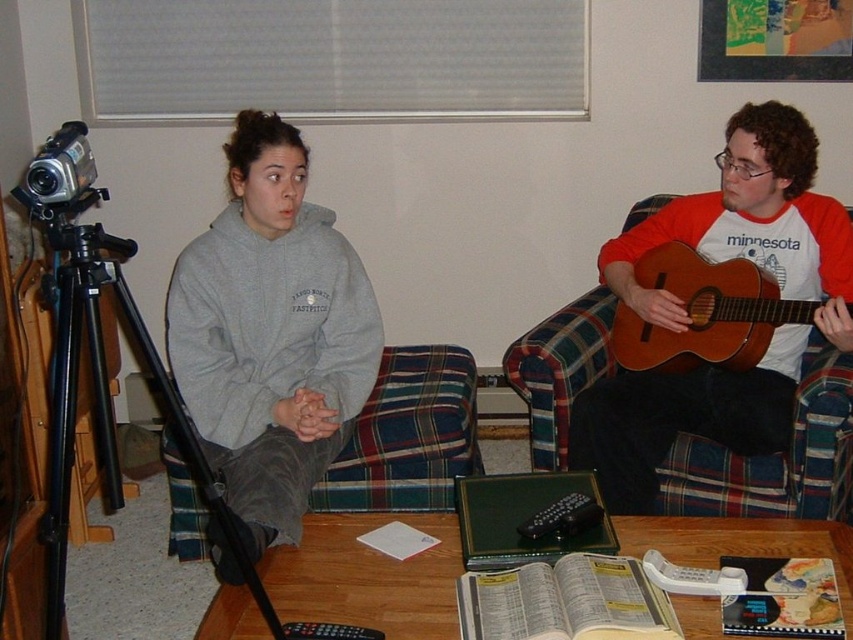
Is brown wooden guitar at right above black plastic remote at lower center?

Correct, brown wooden guitar at right is located above black plastic remote at lower center.

Does point (698, 268) come farther from viewer compared to point (288, 636)?

Yes, it is.

Locate an element on the screen. brown wooden guitar at right is located at coordinates (704, 312).

Does gray fleece sweatshirt at center have a lesser width compared to black plastic remote at lower center?

In fact, gray fleece sweatshirt at center might be wider than black plastic remote at lower center.

Who is positioned more to the right, gray fleece sweatshirt at center or black plastic remote at lower center?

Positioned to the right is black plastic remote at lower center.

Who is more distant from viewer, [190,298] or [326,634]?

The point [190,298] is behind.

Find the location of a particular element. The image size is (853, 640). gray fleece sweatshirt at center is located at coordinates point(270,333).

Is silver plastic video camera at left in front of black plastic remote at center?

Yes, it is in front of black plastic remote at center.

Is point (35, 195) behind point (556, 509)?

No, (35, 195) is in front of (556, 509).

This screenshot has height=640, width=853. In order to click on silver plastic video camera at left in this screenshot , I will do `click(59, 172)`.